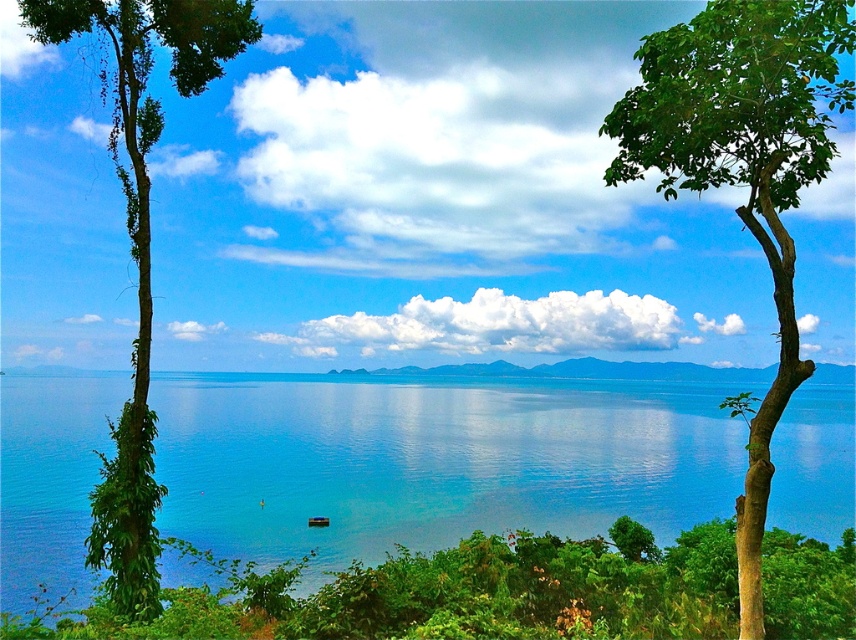
You are standing at the center of the scene and want to walk towards the green leafy tree at right. Which direction should you go relative to the green leafy tree at left?

You should walk towards the right direction relative to the green leafy tree at left because the green leafy tree at right is positioned to the right of it.

You are standing on the beach looking at the scene. Which object, the transparent blue water at center or the green leafy tree at right, is closer to you?

The transparent blue water at center is closer to you because the green leafy tree at right is behind it.

You are standing at the edge of the coastal landscape and want to take a photo of the transparent blue water at center and the green leafy tree at left. Which object will appear closer to the bottom of your photo frame?

The transparent blue water at center is located below the green leafy tree at left, so it will appear closer to the bottom of the photo frame.